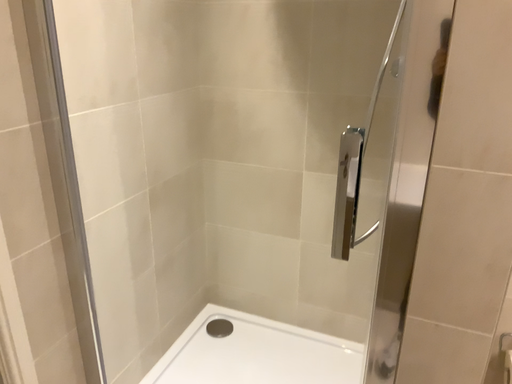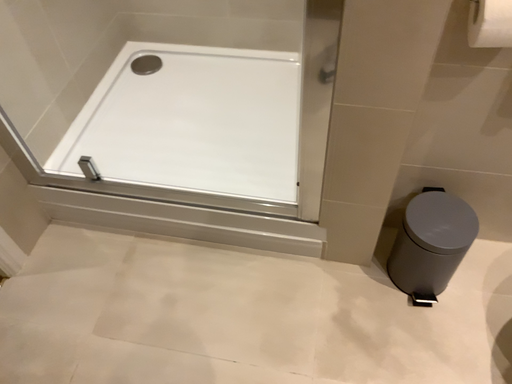
Question: Which way did the camera rotate in the video?

Choices:
 (A) rotated right
 (B) rotated left

Answer: (A)